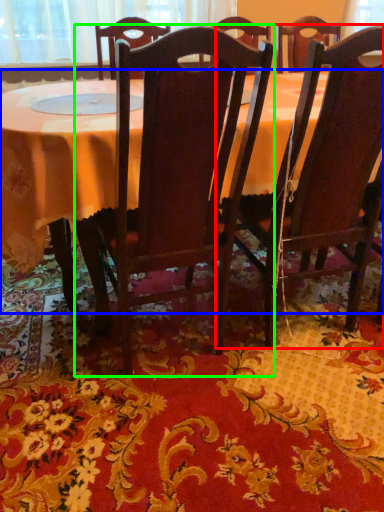
Question: Based on their relative distances, which object is nearer to chair (highlighted by a red box)? Choose from table (highlighted by a blue box) and chair (highlighted by a green box).

Choices:
 (A) table
 (B) chair

Answer: (B)